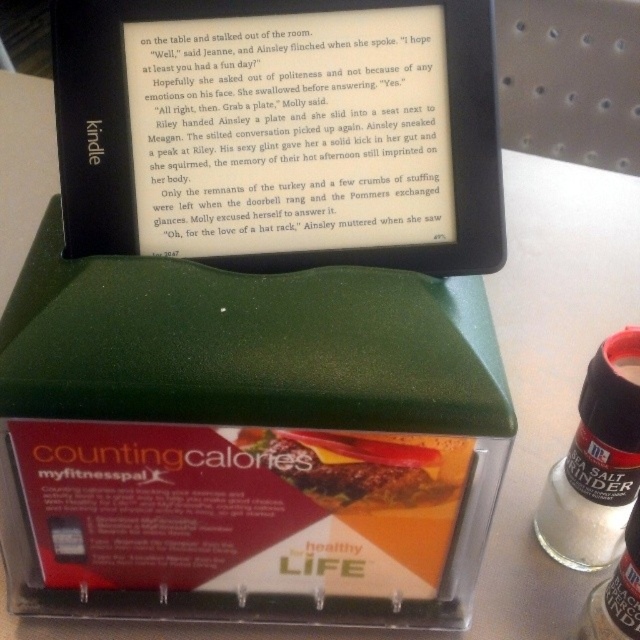
Does white plastic salt grinder at right have a lesser height compared to golden crispy chicken at center?

Incorrect, white plastic salt grinder at right's height does not fall short of golden crispy chicken at center's.

Is white plastic salt grinder at right further to camera compared to golden crispy chicken at center?

Yes, it is behind golden crispy chicken at center.

Find the location of a particular element. This screenshot has width=640, height=640. white plastic salt grinder at right is located at coordinates (595, 465).